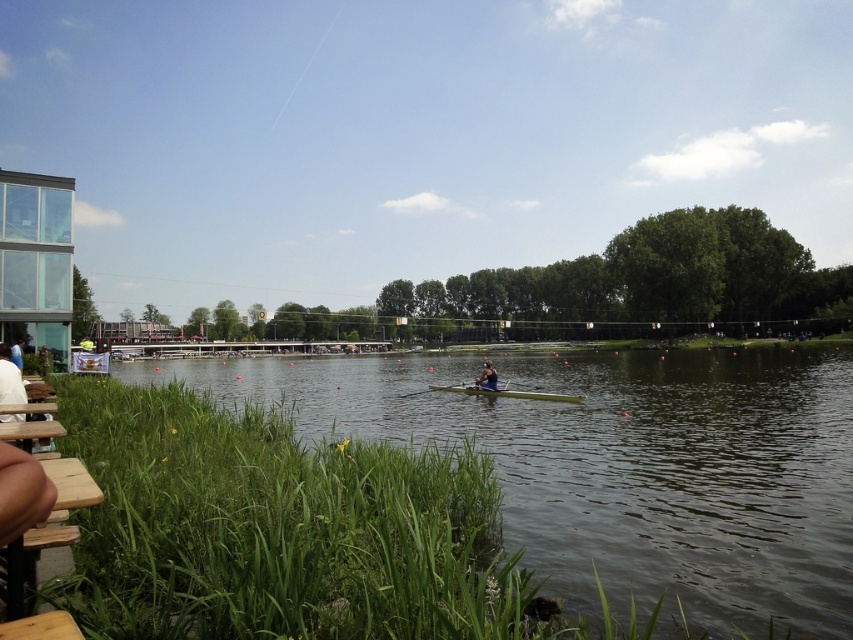
Is green grassy river at center above blue fabric rower at center?

Actually, green grassy river at center is below blue fabric rower at center.

The width and height of the screenshot is (853, 640). Find the location of `green grassy river at center`. green grassy river at center is located at coordinates (624, 464).

Is point (607, 492) positioned behind point (489, 376)?

That is False.

Where is `green grassy river at center`? The image size is (853, 640). green grassy river at center is located at coordinates (624, 464).

Does green grassy river at center have a larger size compared to green smooth canoe at center?

Indeed, green grassy river at center has a larger size compared to green smooth canoe at center.

The image size is (853, 640). What are the coordinates of `green grassy river at center` in the screenshot? It's located at (624, 464).

Which is in front, point (196, 358) or point (497, 385)?

Point (497, 385) is more forward.

Where is `green grassy river at center`? green grassy river at center is located at coordinates (624, 464).

Can you confirm if green smooth canoe at center is positioned below blue fabric rower at center?

Yes, green smooth canoe at center is below blue fabric rower at center.

Identify the location of green smooth canoe at center. (506, 392).